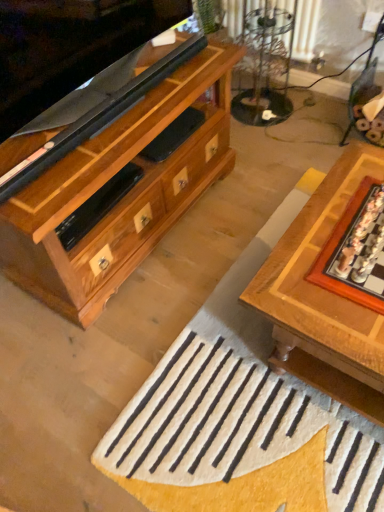
Measure the distance between point (382, 381) and camera.

Point (382, 381) is 3.44 feet away from camera.

What do you see at coordinates (264, 66) in the screenshot? The image size is (384, 512). I see `clear glass table at upper center` at bounding box center [264, 66].

The image size is (384, 512). Find the location of `wooden chessboard at center`. wooden chessboard at center is located at coordinates (323, 298).

Which of these two, white woolen doormat at center or wooden board game at right, is smaller?

wooden board game at right is smaller.

How many degrees apart are the facing directions of white woolen doormat at center and wooden board game at right?

The facing directions of white woolen doormat at center and wooden board game at right are 179 degrees apart.

Is white woolen doormat at center behind wooden board game at right?

Yes, white woolen doormat at center is behind wooden board game at right.

Considering the sizes of objects white woolen doormat at center and wooden board game at right in the image provided, who is thinner, white woolen doormat at center or wooden board game at right?

wooden board game at right is thinner.

In the scene shown: Which of these two, clear glass table at upper center or wooden board game at right, is bigger?

clear glass table at upper center is bigger.

Would you say clear glass table at upper center contains wooden board game at right?

Definitely not — wooden board game at right is not inside clear glass table at upper center.

Identify the location of board game on the right of clear glass table at upper center. (355, 249).

Considering their positions, is clear glass table at upper center located in front of or behind wooden board game at right?

clear glass table at upper center is positioned farther from the viewer than wooden board game at right.

Which object is thinner, clear glass table at upper center or wooden chessboard at center?

clear glass table at upper center is thinner.

You are a GUI agent. You are given a task and a screenshot of the screen. Output one action in this format:
    pyautogui.click(x=<x>, y=<y>)
    Task: Click on the table located on the right of clear glass table at upper center
    
    Given the screenshot: What is the action you would take?
    pyautogui.click(x=323, y=298)

Would you consider clear glass table at upper center to be distant from wooden chessboard at center?

Yes, clear glass table at upper center is far from wooden chessboard at center.

Can wooden chessboard at center be found inside clear glass table at upper center?

No, wooden chessboard at center is located outside of clear glass table at upper center.

Could you tell me if wooden board game at right is facing clear glass table at upper center?

No.

From a real-world perspective, is wooden board game at right above or below clear glass table at upper center?

wooden board game at right is above clear glass table at upper center.

The height and width of the screenshot is (512, 384). In order to click on glass table beneath the wooden board game at right (from a real-world perspective) in this screenshot , I will do `click(264, 66)`.

Based on the photo, which object is positioned more to the left, wooden board game at right or clear glass table at upper center?

clear glass table at upper center is more to the left.

Are white woolen doormat at center and clear glass table at upper center beside each other?

They are not placed beside each other.

Identify the location of glass table that appears on the left of white woolen doormat at center. (264, 66).

Consider the image. From the image's perspective, which object appears higher, wooden board game at right or white woolen doormat at center?

From the image's view, wooden board game at right is above.

Identify the location of board game that is on the right side of white woolen doormat at center. This screenshot has width=384, height=512. [x=355, y=249].

Is wooden board game at right in front of or behind white woolen doormat at center in the image?

Visually, wooden board game at right is located in front of white woolen doormat at center.

Which of these two, wooden board game at right or white woolen doormat at center, is thinner?

Thinner between the two is wooden board game at right.

From the picture: Considering the sizes of wooden chessboard at center and clear glass table at upper center in the image, is wooden chessboard at center wider or thinner than clear glass table at upper center?

In the image, wooden chessboard at center appears to be wider than clear glass table at upper center.

Find the location of a particular element. The height and width of the screenshot is (512, 384). table below the clear glass table at upper center (from a real-world perspective) is located at coordinates (323, 298).

Between wooden chessboard at center and clear glass table at upper center, which one is positioned in front?

Positioned in front is wooden chessboard at center.

Consider the image. From the image's perspective, is wooden chessboard at center located beneath clear glass table at upper center?

Yes.

Locate an element on the screen. This screenshot has width=384, height=512. board game that is above the white woolen doormat at center (from a real-world perspective) is located at coordinates (355, 249).

The width and height of the screenshot is (384, 512). Identify the location of glass table located above the wooden board game at right (from the image's perspective). (264, 66).

Considering their positions, is wooden board game at right positioned closer to wooden chessboard at center than white woolen doormat at center?

The object closer to wooden chessboard at center is wooden board game at right.

Based on their spatial positions, is wooden chessboard at center or wooden board game at right closer to white woolen doormat at center?

Among the two, wooden chessboard at center is located nearer to white woolen doormat at center.

From the image, which object appears to be farther from clear glass table at upper center, wooden chessboard at center or white woolen doormat at center?

white woolen doormat at center lies further to clear glass table at upper center than the other object.

Considering their positions, is clear glass table at upper center positioned further to white woolen doormat at center than wooden chessboard at center?

The object further to white woolen doormat at center is clear glass table at upper center.

When comparing their distances from clear glass table at upper center, does white woolen doormat at center or wooden chessboard at center seem further?

white woolen doormat at center is further to clear glass table at upper center.

When comparing their distances from wooden board game at right, does clear glass table at upper center or white woolen doormat at center seem closer?

The object closer to wooden board game at right is white woolen doormat at center.

When comparing their distances from white woolen doormat at center, does wooden chessboard at center or clear glass table at upper center seem further?

Among the two, clear glass table at upper center is located further to white woolen doormat at center.

From the image, which object appears to be nearer to clear glass table at upper center, wooden board game at right or wooden chessboard at center?

wooden chessboard at center is positioned closer to the anchor clear glass table at upper center.

Locate an element on the screen. board game between clear glass table at upper center and white woolen doormat at center in the up-down direction is located at coordinates (355, 249).

Locate an element on the screen. table between wooden board game at right and white woolen doormat at center vertically is located at coordinates (323, 298).

Locate an element on the screen. table that lies between clear glass table at upper center and white woolen doormat at center from top to bottom is located at coordinates (323, 298).

Image resolution: width=384 pixels, height=512 pixels. Identify the location of board game between clear glass table at upper center and wooden chessboard at center from top to bottom. (355, 249).